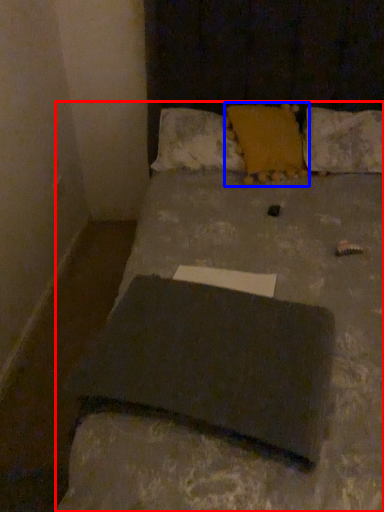
Question: Which point is further to the camera, bed (highlighted by a red box) or pillow (highlighted by a blue box)?

Choices:
 (A) bed
 (B) pillow

Answer: (B)